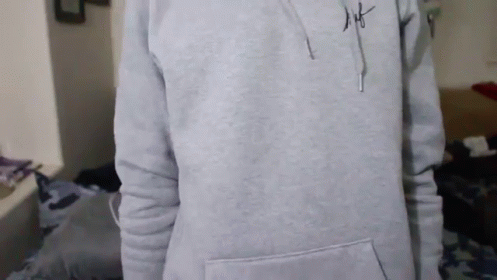
This screenshot has height=280, width=497. In order to click on top left tip of cammo pillow toward the right in this screenshot , I will do `click(37, 171)`.